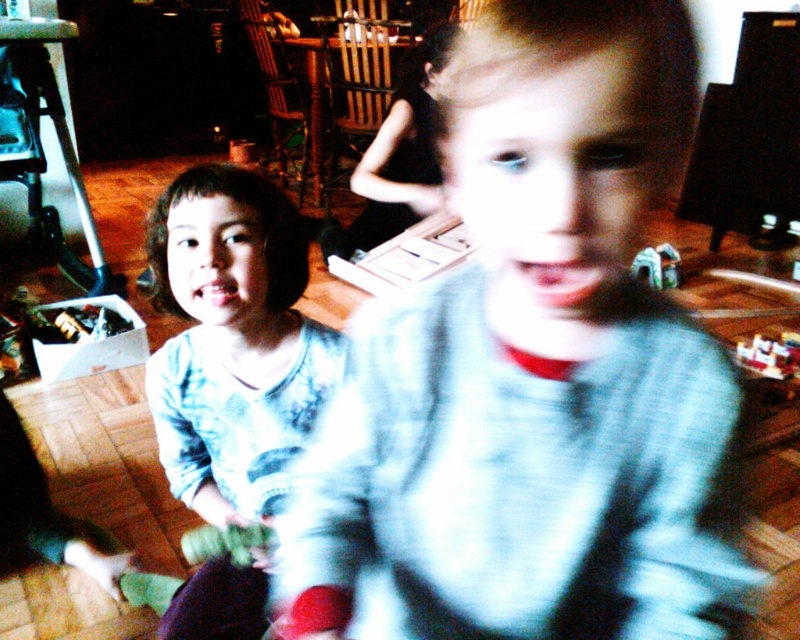
Question: Can you confirm if light blue sweater at center is positioned to the right of plastic toy car at lower right?

Choices:
 (A) no
 (B) yes

Answer: (A)

Question: Which object is positioned closest to the light blue cotton shirt at center?

Choices:
 (A) light blue sweater at center
 (B) plastic toy car at center

Answer: (A)

Question: Is light blue sweater at center above plastic toy car at lower right?

Choices:
 (A) yes
 (B) no

Answer: (A)

Question: Estimate the real-world distances between objects in this image. Which object is closer to the light blue sweater at center?

Choices:
 (A) plastic toy car at lower right
 (B) light blue cotton shirt at center

Answer: (B)

Question: Which is farther from the light blue cotton shirt at center?

Choices:
 (A) plastic toy car at lower right
 (B) light blue sweater at center

Answer: (A)

Question: Is light blue sweater at center smaller than plastic toy car at lower right?

Choices:
 (A) yes
 (B) no

Answer: (B)